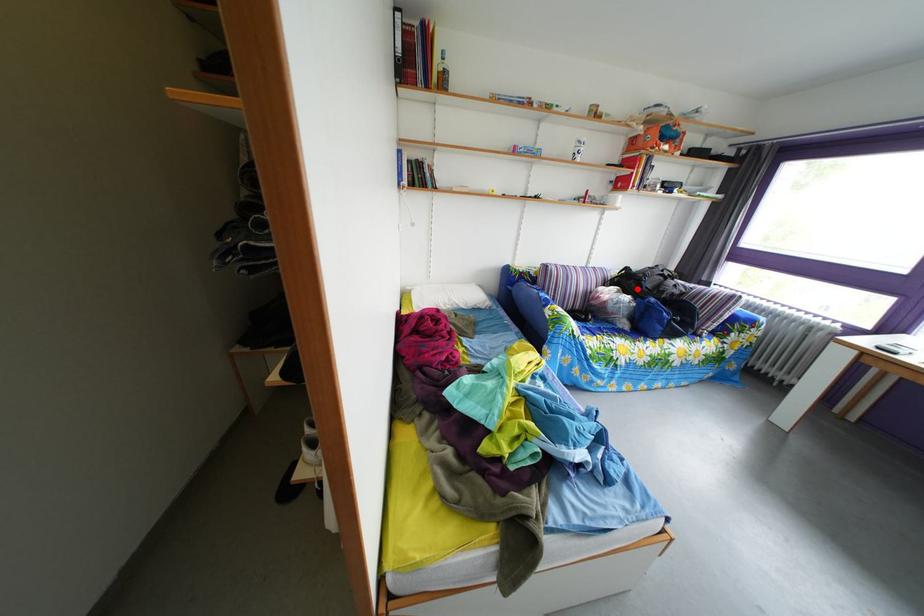
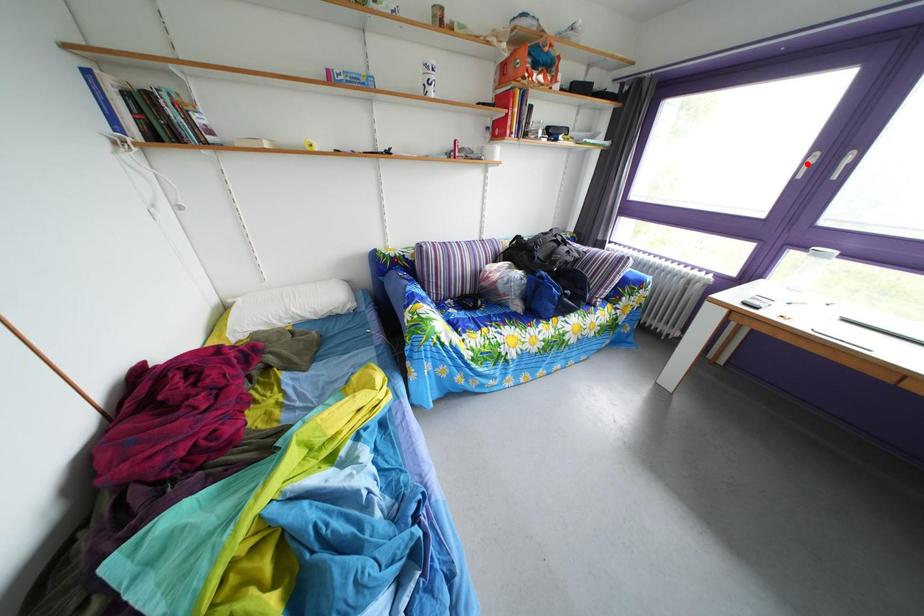
I am providing you with two images of the same scene from different viewpoints. A red point is marked on the first image and another point is marked on the second image. Is the marked point in image1 the same physical position as the marked point in image2?

No